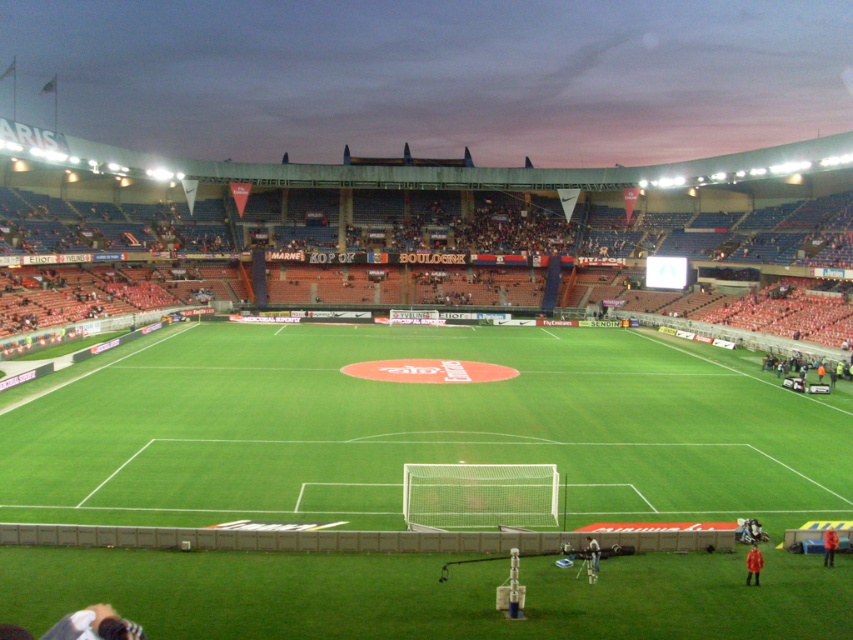
Is red jacket at center taller than red fabric person at lower center?

Indeed, red jacket at center has a greater height compared to red fabric person at lower center.

Does point (747, 579) come in front of point (595, 556)?

Yes, it is in front of point (595, 556).

Locate an element on the screen. red jacket at center is located at coordinates (753, 564).

Can you confirm if green grass football field at center is taller than red fabric person at lower center?

Yes, green grass football field at center is taller than red fabric person at lower center.

Is green grass football field at center to the left of red fabric person at lower center from the viewer's perspective?

Correct, you'll find green grass football field at center to the left of red fabric person at lower center.

Find the location of a particular element. The height and width of the screenshot is (640, 853). green grass football field at center is located at coordinates (419, 428).

Who is more forward, (756, 573) or (824, 547)?

Point (756, 573) is in front.

At what (x,y) coordinates should I click in order to perform the action: click on red jacket at center. Please return your answer as a coordinate pair (x, y). Looking at the image, I should click on (753, 564).